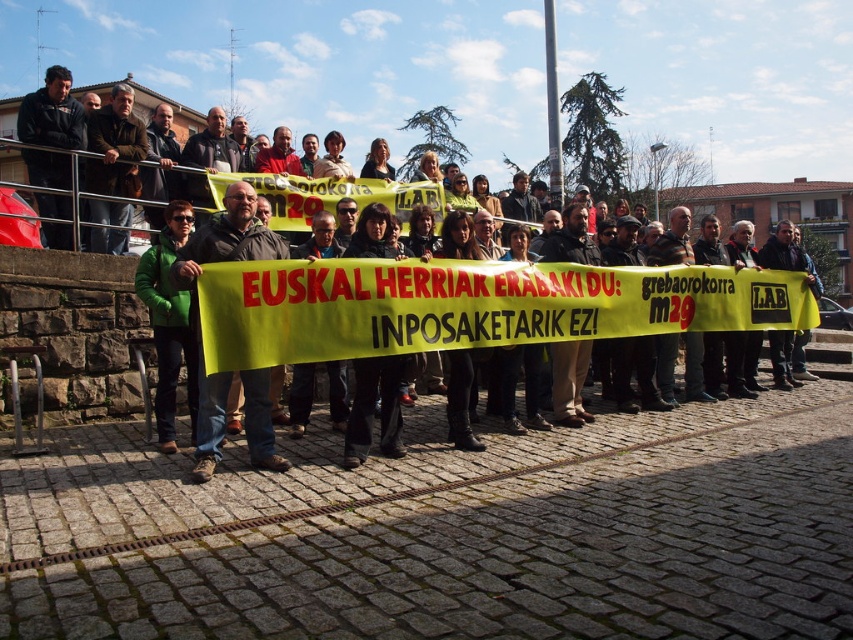
Does green fabric banner at center appear under dark brown leather jacket at center?

No, green fabric banner at center is not below dark brown leather jacket at center.

Which is below, green fabric banner at center or dark brown leather jacket at center?

Positioned lower is dark brown leather jacket at center.

Does point (67, 356) lie behind point (193, 257)?

That is True.

Locate an element on the screen. Image resolution: width=853 pixels, height=640 pixels. green fabric banner at center is located at coordinates (74, 324).